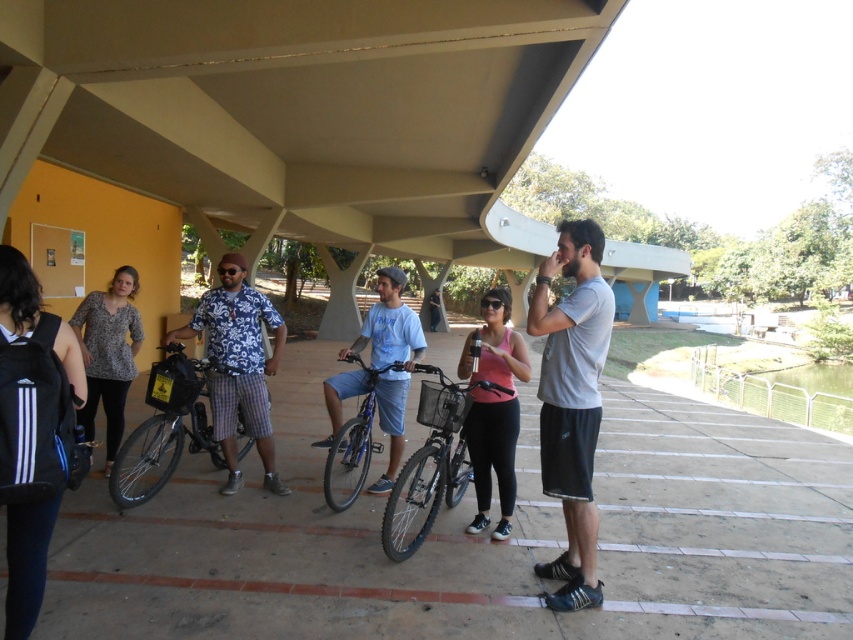
You are a photographer trying to capture the Hawaiian shirt at center and the shiny blue bicycle at center in the same frame. Since the bicycle is behind the shirt, will you need to adjust your position to include both in the photo?

The shiny blue bicycle at center is behind the hawaiian shirt at center, so you will need to move your position to either side to ensure both the Hawaiian shirt at center and the shiny blue bicycle at center are visible in the frame.